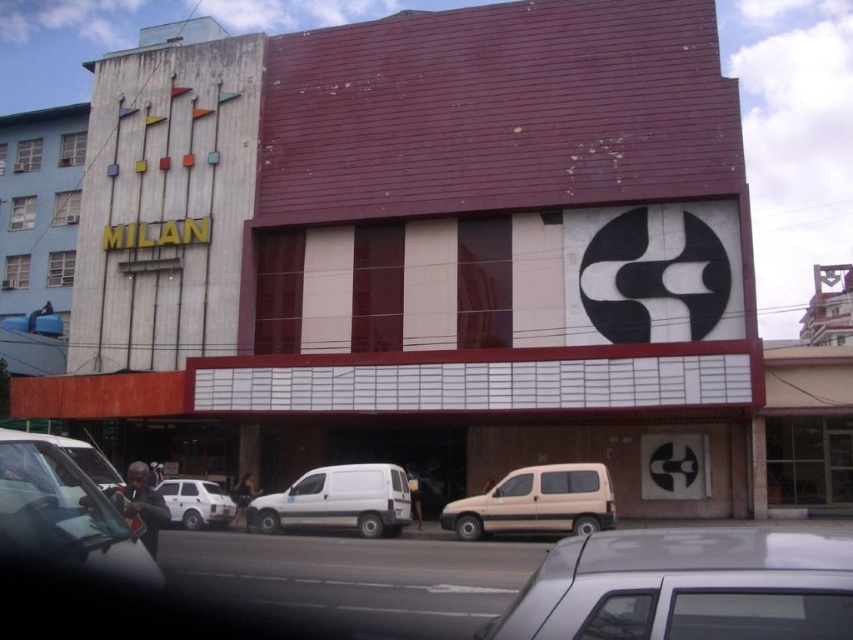
You are a delivery driver who needs to park your white matte van at center as close as possible to the maroon brick theater at center without blocking the entrance. The parking area allows vehicles to park up to 10 meters away from the theater. Can you park your van within the allowed distance?

The distance between the maroon brick theater at center and the white matte van at center is 13.55 meters, which exceeds the parking area limit of 10 meters. Therefore, you cannot park the van within the allowed distance without violating the parking rules.

You are a delivery driver who needs to park your white matte van at center in front of the maroon brick theater at center. The parking space is exactly the same width as the theater. Will the van fit in the parking space?

The maroon brick theater at center is wider than the white matte van at center, so the van will fit in the parking space since it is narrower than the theater.

You are a delivery driver who needs to park your beige matte van at center and white matte van at center in a tight alley. The alley is only wide enough for one van. Which van should you move first to ensure the other can fit?

The beige matte van at center is positioned on the right side of the white matte van at center. Since the alley can only fit one van, you should move the beige matte van at center first to allow the white matte van at center to be parked in its place without obstruction.